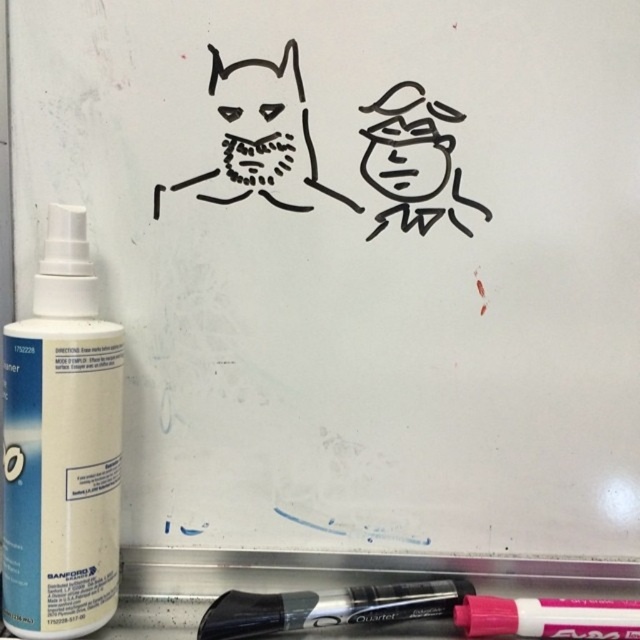
You are standing in front of a whiteboard with two drawings. You need to clean the whiteboard using the white plastic spray bottle at left. Where should you spray the spray bottle to reach the drawing of the dog?

The white plastic spray bottle at left is located at point (61, 445), so you should spray towards the left side of the whiteboard where the dog drawing is located.

You are organizing a classroom and need to place the white plastic spray bottle at left and the black matte marker at lower center into storage. The storage container can only hold items that are smaller than 15 centimeters in length. Based on the description, will both items fit?

The white plastic spray bottle at left is larger than the black matte marker at lower center. Since the spray bottle is bigger, it might exceed the 15 cm limit, but the marker could fit. However, without exact measurements, we can only conclude that the black matte marker at lower center is smaller and may fit, while the white plastic spray bottle at left might not.